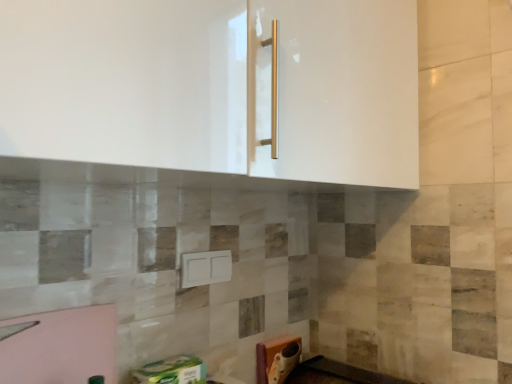
What do you see at coordinates (336, 374) in the screenshot? I see `black glossy countertop at lower center` at bounding box center [336, 374].

At what (x,y) coordinates should I click in order to perform the action: click on black glossy countertop at lower center. Please return your answer as a coordinate pair (x, y). Looking at the image, I should click on (336, 374).

At what (x,y) coordinates should I click in order to perform the action: click on black glossy countertop at lower center. Please return your answer as a coordinate pair (x, y). Looking at the image, I should click on (336, 374).